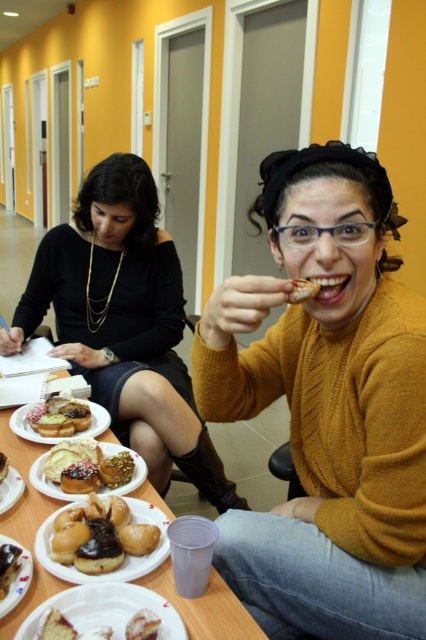
Which is above, powdered sugar cake at center or glazed sugar donut at center?

glazed sugar donut at center

Which is more to the left, powdered sugar cake at center or glazed sugar donut at center?

glazed sugar donut at center

Where is `powdered sugar cake at center`? powdered sugar cake at center is located at coordinates click(x=66, y=627).

Which is more to the right, mustard sweater at center or powdered sugar cake at center?

mustard sweater at center is more to the right.

Does point (215, 561) lie behind point (42, 621)?

Yes, it is.

What do you see at coordinates (327, 406) in the screenshot? Image resolution: width=426 pixels, height=640 pixels. I see `mustard sweater at center` at bounding box center [327, 406].

Image resolution: width=426 pixels, height=640 pixels. In order to click on mustard sweater at center in this screenshot , I will do `click(327, 406)`.

Does matte plastic table at center have a smaller size compared to matte plastic plate at lower left?

No, matte plastic table at center is not smaller than matte plastic plate at lower left.

Between matte plastic table at center and matte plastic plate at lower left, which one has more height?

matte plastic table at center is taller.

Is point (106, 429) positioned before point (8, 595)?

No, it is not.

Locate an element on the screen. The width and height of the screenshot is (426, 640). matte plastic table at center is located at coordinates (204, 608).